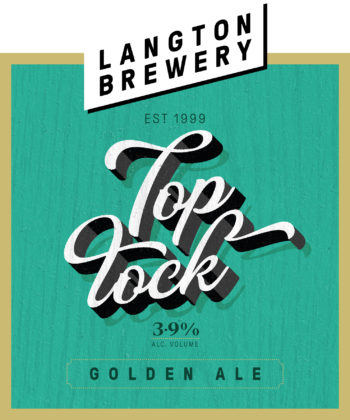
Find the location of a particular element. This screenshot has width=350, height=420. lock is located at coordinates (140, 280).